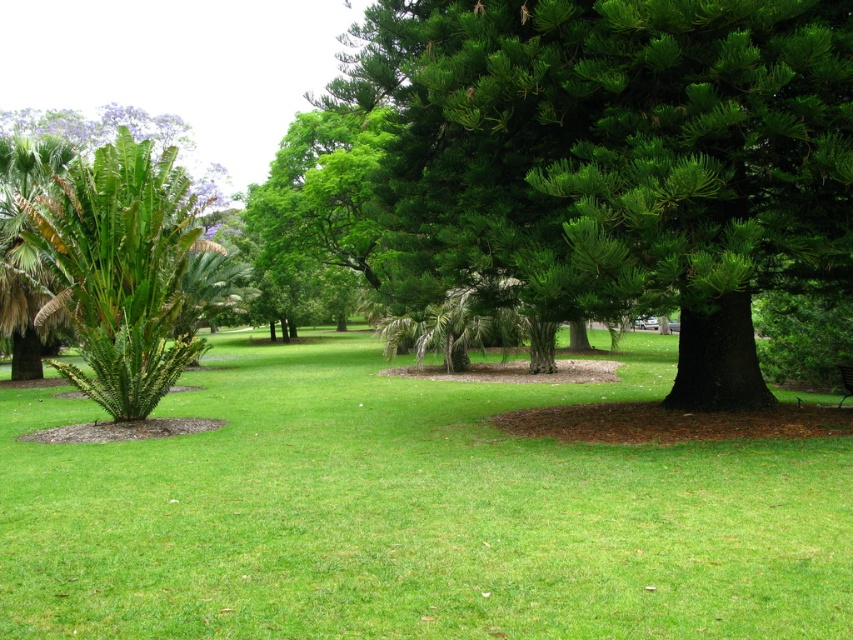
Question: Does green grassy at center come in front of green leafy palm tree at left?

Choices:
 (A) no
 (B) yes

Answer: (B)

Question: Which point is farther from the camera taking this photo?

Choices:
 (A) (125, 176)
 (B) (302, 436)

Answer: (A)

Question: Which object appears farthest from the camera in this image?

Choices:
 (A) green grassy at center
 (B) green leafy palm tree at left

Answer: (B)

Question: Does green grassy at center have a smaller size compared to green leafy palm tree at left?

Choices:
 (A) yes
 (B) no

Answer: (A)

Question: Is green grassy at center positioned before green leafy palm tree at left?

Choices:
 (A) yes
 (B) no

Answer: (A)

Question: Among these objects, which one is farthest from the camera?

Choices:
 (A) green grassy at center
 (B) green leafy palm tree at left

Answer: (B)